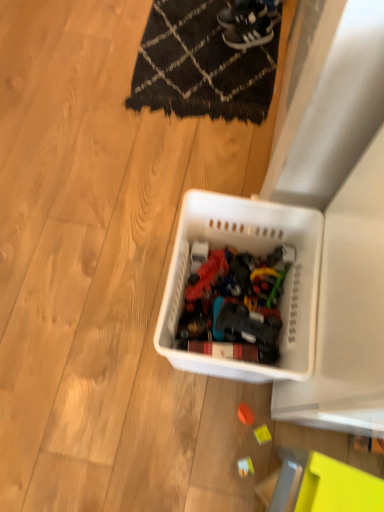
Locate an element on the screen. vacant area that lies between white plastic basket at center and white plastic toy at lower center, which ranks as the 1th toy in bottom-to-top order is located at coordinates (224, 412).